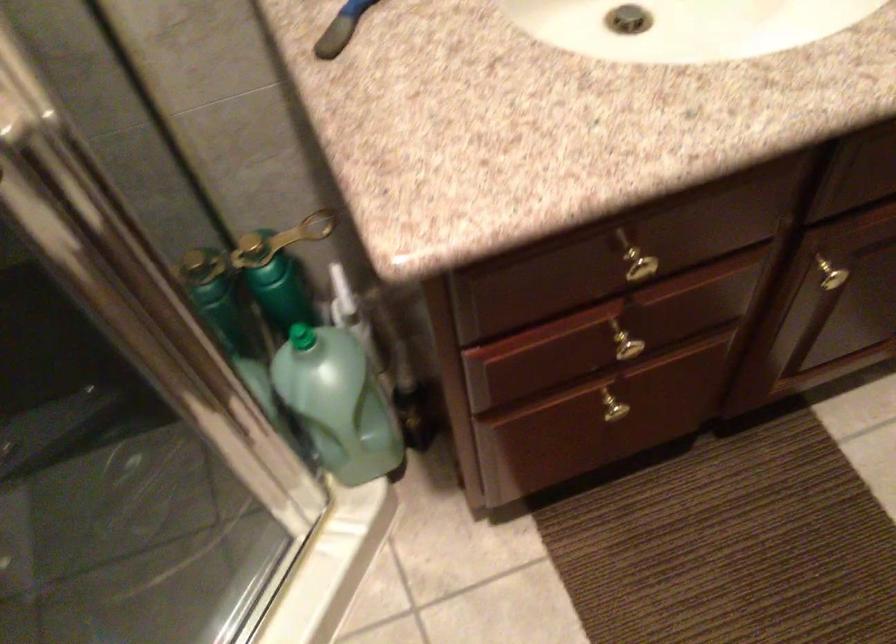
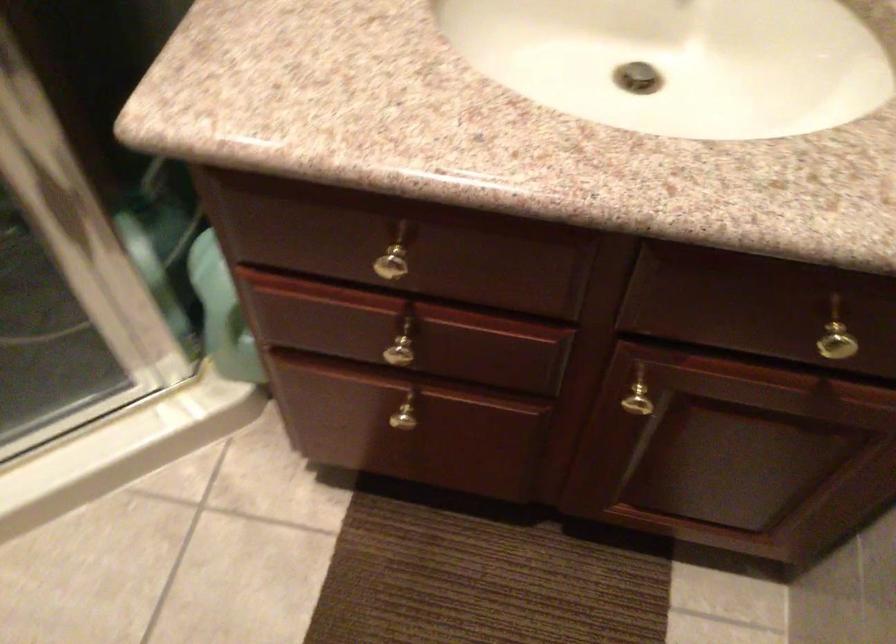
Question: I am providing you with two images of the same scene from different viewpoints. Which of the following objects are not visible in image2?

Choices:
 (A) gold cabinet knob
 (B) red beverage can
 (C) gold metal key
 (D) gold drawer knob

Answer: (C)